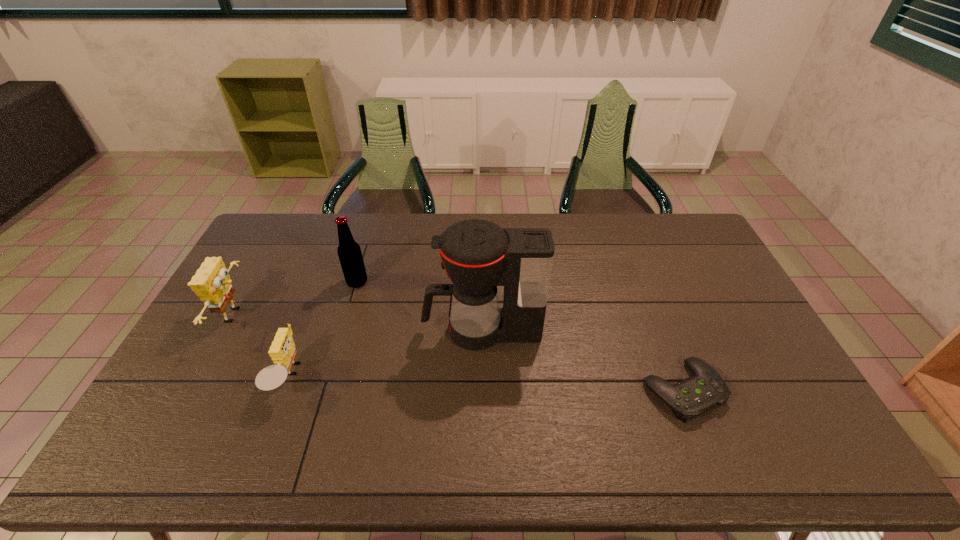
You are a GUI agent. You are given a task and a screenshot of the screen. Output one action in this format:
    pyautogui.click(x=<x>, y=<y>)
    Task: Click on the free space that satisfies the following two spatial constraints: 1. on the face of the rightmost object; 2. on the right side of the left sponge
    The width and height of the screenshot is (960, 540).
    Given the screenshot: What is the action you would take?
    pyautogui.click(x=195, y=390)